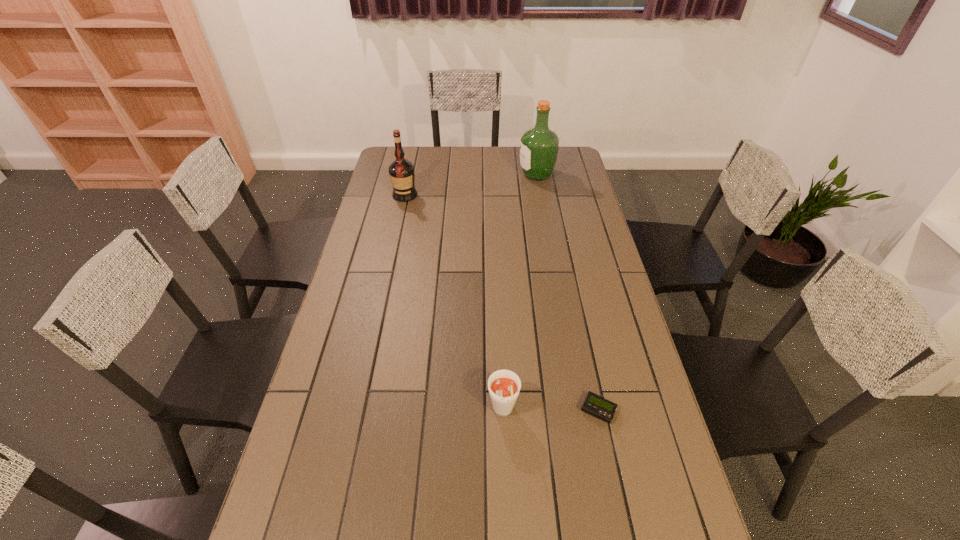
This screenshot has width=960, height=540. Find the location of `vacant position at the right edge of the desktop`. vacant position at the right edge of the desktop is located at coordinates (629, 423).

Identify the location of free space at the far right corner of the desktop. This screenshot has width=960, height=540. (564, 148).

The width and height of the screenshot is (960, 540). I want to click on unoccupied position between the third tallest object and the beeper, so click(550, 411).

Image resolution: width=960 pixels, height=540 pixels. I want to click on empty space that is in between the third tallest object and the farthest object, so tap(519, 294).

Where is `free area in between the right liquor and the leftmost object`? Image resolution: width=960 pixels, height=540 pixels. free area in between the right liquor and the leftmost object is located at coordinates (470, 185).

I want to click on free space between the farthest object and the leftmost object, so click(x=470, y=185).

At what (x,y) coordinates should I click in order to perform the action: click on vacant space that is in between the beeper and the farthest object. Please return your answer as a coordinate pair (x, y). The height and width of the screenshot is (540, 960). Looking at the image, I should click on (567, 292).

Where is `vacant space that is in between the shorter liquor and the second shortest object`? vacant space that is in between the shorter liquor and the second shortest object is located at coordinates (454, 304).

Image resolution: width=960 pixels, height=540 pixels. In order to click on vacant space that is in between the beeper and the farthest object in this screenshot , I will do `click(567, 292)`.

This screenshot has width=960, height=540. In order to click on vacant region between the farther liquor and the nearer liquor in this screenshot , I will do `click(470, 185)`.